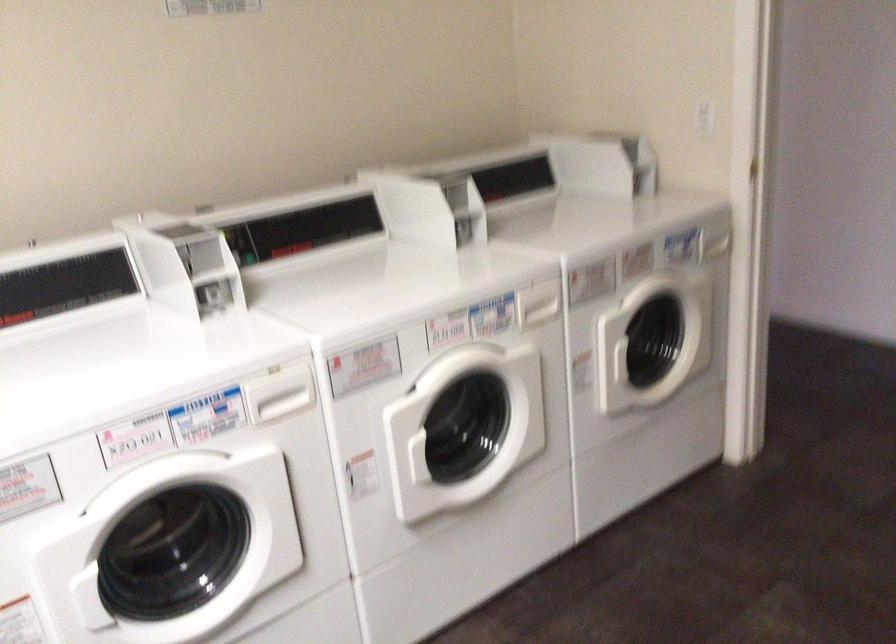
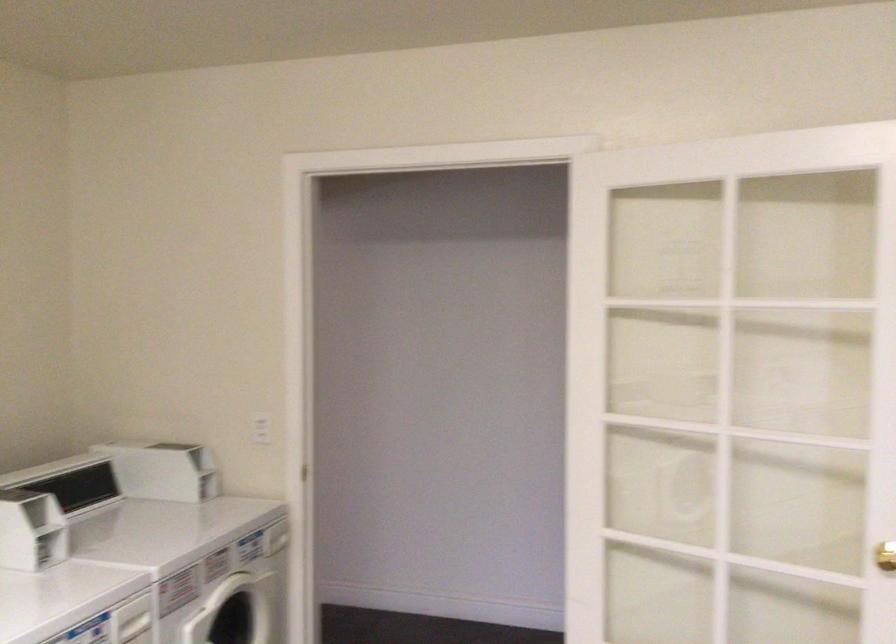
In the second image, find the point that corresponds to [492,174] in the first image.

(70, 482)